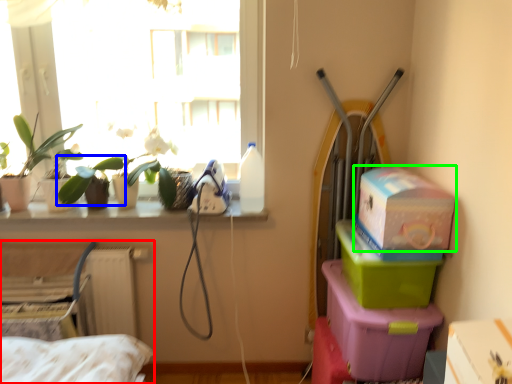
Question: Estimate the real-world distances between objects in this image. Which object is closer to bed (highlighted by a red box), plant (highlighted by a blue box) or box (highlighted by a green box)?

Choices:
 (A) plant
 (B) box

Answer: (A)